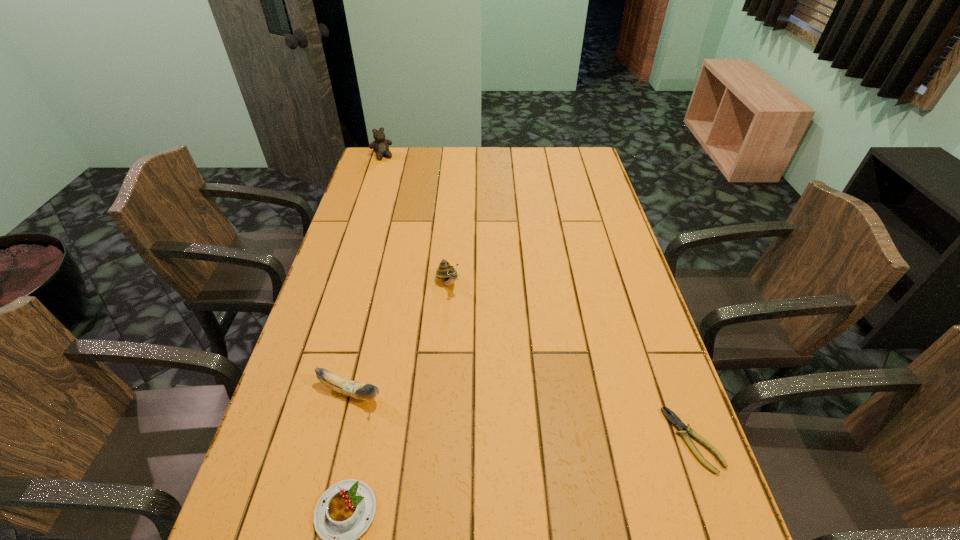
Where is `free space on the desktop that is between the second shortest object and the rightmost object and is positioned on the face of the farthest object`? This screenshot has height=540, width=960. free space on the desktop that is between the second shortest object and the rightmost object and is positioned on the face of the farthest object is located at coordinates (564, 467).

At what (x,y) coordinates should I click in order to perform the action: click on free space on the desktop that is between the nearest object and the pliers and is positioned on the face of the snail. Please return your answer as a coordinate pair (x, y). Looking at the image, I should click on (562, 467).

You are a GUI agent. You are given a task and a screenshot of the screen. Output one action in this format:
    pyautogui.click(x=<x>, y=<y>)
    Task: Click on the free space on the desktop that is between the second shortest object and the pliers and is positioned at the stem of the banana
    Image resolution: width=960 pixels, height=540 pixels.
    Given the screenshot: What is the action you would take?
    pyautogui.click(x=546, y=470)